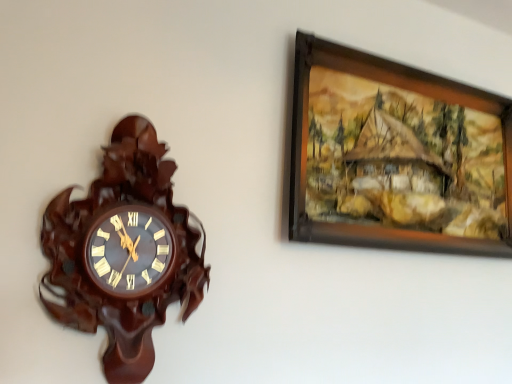
Describe the element at coordinates (396, 156) in the screenshot. I see `brown wooden picture frame at upper right` at that location.

At what (x,y) coordinates should I click in order to perform the action: click on brown wooden picture frame at upper right. Please return your answer as a coordinate pair (x, y). Looking at the image, I should click on (396, 156).

Measure the distance between mahogany wood wall clock at left and camera.

They are 31.44 inches apart.

Describe the element at coordinates (123, 251) in the screenshot. I see `mahogany wood wall clock at left` at that location.

At what (x,y) coordinates should I click in order to perform the action: click on mahogany wood wall clock at left. Please return your answer as a coordinate pair (x, y). The image size is (512, 384). Looking at the image, I should click on (123, 251).

What is the approximate width of mahogany wood wall clock at left?

It is 3.74 inches.

Locate an element on the screen. brown wooden picture frame at upper right is located at coordinates tap(396, 156).

Between brown wooden picture frame at upper right and mahogany wood wall clock at left, which one appears on the left side from the viewer's perspective?

Positioned to the left is mahogany wood wall clock at left.

Which object is further away from the camera taking this photo, brown wooden picture frame at upper right or mahogany wood wall clock at left?

Positioned behind is brown wooden picture frame at upper right.

Is point (324, 54) closer to camera compared to point (102, 197)?

No, it is not.

From the image's perspective, which one is positioned lower, brown wooden picture frame at upper right or mahogany wood wall clock at left?

mahogany wood wall clock at left is shown below in the image.

From a real-world perspective, relative to mahogany wood wall clock at left, is brown wooden picture frame at upper right vertically above or below?

In terms of real-world spatial position, brown wooden picture frame at upper right is above mahogany wood wall clock at left.

Between brown wooden picture frame at upper right and mahogany wood wall clock at left, which one has larger width?

Wider between the two is mahogany wood wall clock at left.

Between brown wooden picture frame at upper right and mahogany wood wall clock at left, which one has more height?

Standing taller between the two is mahogany wood wall clock at left.

In terms of size, does brown wooden picture frame at upper right appear bigger or smaller than mahogany wood wall clock at left?

Considering their sizes, brown wooden picture frame at upper right takes up more space than mahogany wood wall clock at left.

Can we say brown wooden picture frame at upper right lies outside mahogany wood wall clock at left?

Indeed, brown wooden picture frame at upper right is completely outside mahogany wood wall clock at left.

Is there a large distance between brown wooden picture frame at upper right and mahogany wood wall clock at left?

No.

Is brown wooden picture frame at upper right facing towards mahogany wood wall clock at left?

No.

How far apart are brown wooden picture frame at upper right and mahogany wood wall clock at left?

brown wooden picture frame at upper right and mahogany wood wall clock at left are 21.13 inches apart from each other.

Identify the location of picture frame behind the mahogany wood wall clock at left. The image size is (512, 384). click(396, 156).

Between mahogany wood wall clock at left and brown wooden picture frame at upper right, which one appears on the right side from the viewer's perspective?

brown wooden picture frame at upper right.

Is the position of mahogany wood wall clock at left more distant than that of brown wooden picture frame at upper right?

No, mahogany wood wall clock at left is in front of brown wooden picture frame at upper right.

Does point (134, 124) lie in front of point (342, 238)?

Yes, point (134, 124) is in front of point (342, 238).

From the image's perspective, which one is positioned higher, mahogany wood wall clock at left or brown wooden picture frame at upper right?

brown wooden picture frame at upper right appears higher in the image.

From a real-world perspective, between mahogany wood wall clock at left and brown wooden picture frame at upper right, who is vertically lower?

From a 3D spatial view, mahogany wood wall clock at left is below.

Considering the sizes of mahogany wood wall clock at left and brown wooden picture frame at upper right in the image, is mahogany wood wall clock at left wider or thinner than brown wooden picture frame at upper right?

Considering their sizes, mahogany wood wall clock at left looks broader than brown wooden picture frame at upper right.

Which of these two, mahogany wood wall clock at left or brown wooden picture frame at upper right, stands shorter?

brown wooden picture frame at upper right.

Between mahogany wood wall clock at left and brown wooden picture frame at upper right, which one has smaller size?

With smaller size is mahogany wood wall clock at left.

In the scene shown: Is mahogany wood wall clock at left positioned beyond the bounds of brown wooden picture frame at upper right?

That's correct, mahogany wood wall clock at left is outside of brown wooden picture frame at upper right.

Is mahogany wood wall clock at left not close to brown wooden picture frame at upper right?

No, mahogany wood wall clock at left is in close proximity to brown wooden picture frame at upper right.

Is mahogany wood wall clock at left positioned with its back to brown wooden picture frame at upper right?

That's not correct — mahogany wood wall clock at left is not looking away from brown wooden picture frame at upper right.

How different are the orientations of mahogany wood wall clock at left and brown wooden picture frame at upper right in degrees?

There is a 0.00303-degree angle between the facing directions of mahogany wood wall clock at left and brown wooden picture frame at upper right.

Identify the location of picture frame located on the right of mahogany wood wall clock at left. Image resolution: width=512 pixels, height=384 pixels. (396, 156).

In order to click on picture frame lying above the mahogany wood wall clock at left (from the image's perspective) in this screenshot , I will do `click(396, 156)`.

I want to click on wall clock to the left of brown wooden picture frame at upper right, so click(123, 251).